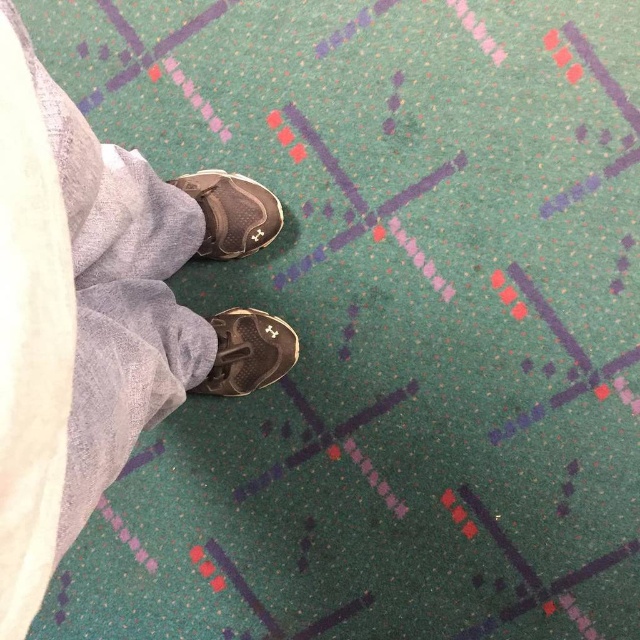
Between matte gray pants at center and matte gray sneaker at center, which one has less height?

With less height is matte gray sneaker at center.

Is matte gray pants at center to the left of matte gray sneaker at center from the viewer's perspective?

Yes, matte gray pants at center is to the left of matte gray sneaker at center.

Who is more distant from viewer, (76,536) or (236,244)?

The point (236,244) is behind.

I want to click on matte gray pants at center, so click(99, 314).

Is the position of matte gray sneaker at center less distant than that of matte black sneaker at center?

No, matte gray sneaker at center is behind matte black sneaker at center.

Does point (205, 228) come in front of point (268, 353)?

Yes, point (205, 228) is in front of point (268, 353).

Locate an element on the screen. The width and height of the screenshot is (640, 640). matte gray sneaker at center is located at coordinates (232, 212).

Does point (3, 198) lie behind point (250, 381)?

No, (3, 198) is closer to viewer.

Where is `matte gray pants at center`? matte gray pants at center is located at coordinates (99, 314).